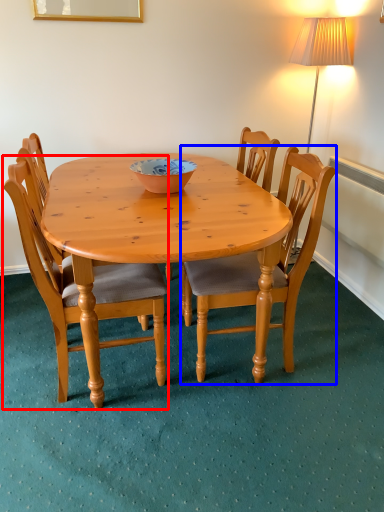
Question: Among these objects, which one is farthest to the camera, chair (highlighted by a red box) or chair (highlighted by a blue box)?

Choices:
 (A) chair
 (B) chair

Answer: (B)